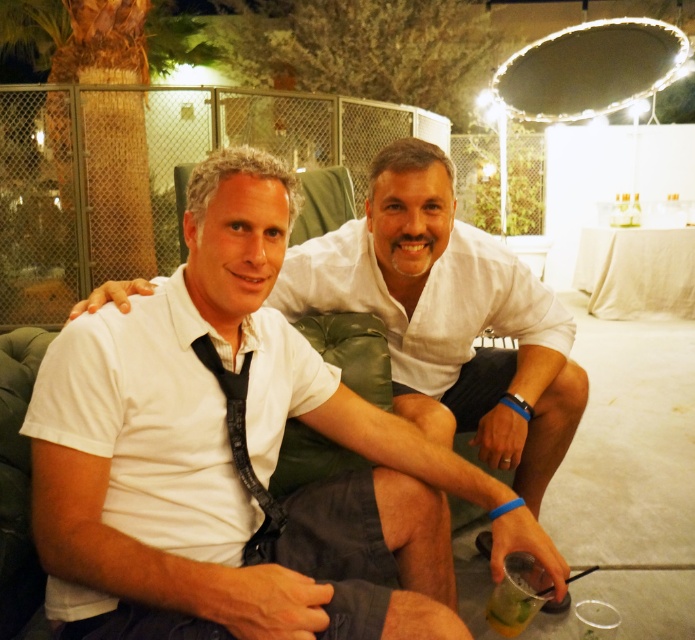
Question: Is white cotton shirt at center closer to the viewer compared to clear plastic cup at lower right?

Choices:
 (A) yes
 (B) no

Answer: (B)

Question: Which point appears farthest from the camera in this image?

Choices:
 (A) (332, 284)
 (B) (518, 596)

Answer: (A)

Question: Which point is farther to the camera?

Choices:
 (A) (512, 621)
 (B) (377, 188)

Answer: (B)

Question: Which object appears closest to the camera in this image?

Choices:
 (A) clear plastic cup at lower right
 (B) white cotton shirt at center

Answer: (A)

Question: Does white cotton shirt at center appear on the right side of clear plastic cup at lower right?

Choices:
 (A) no
 (B) yes

Answer: (A)

Question: Is white cotton shirt at center further to the viewer compared to clear plastic cup at lower right?

Choices:
 (A) no
 (B) yes

Answer: (B)